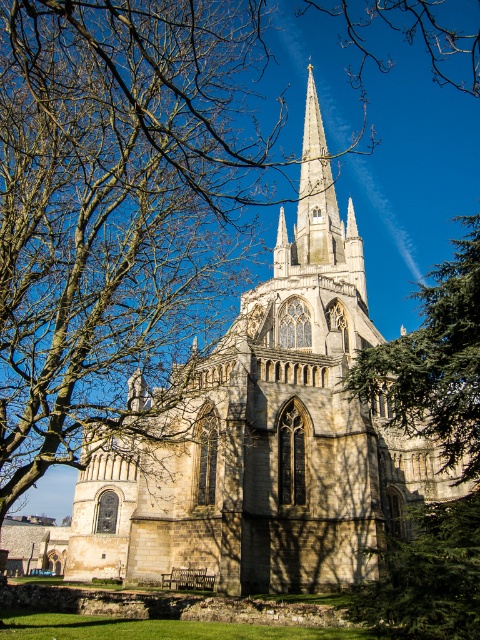
Is the position of stone church at center less distant than that of green leafy tree at right?

No, it is not.

Between stone church at center and green leafy tree at right, which one is positioned higher?

Positioned higher is stone church at center.

Image resolution: width=480 pixels, height=640 pixels. What do you see at coordinates (266, 435) in the screenshot? I see `stone church at center` at bounding box center [266, 435].

The height and width of the screenshot is (640, 480). I want to click on stone church at center, so click(x=266, y=435).

The height and width of the screenshot is (640, 480). Describe the element at coordinates (434, 362) in the screenshot. I see `green leafy tree at right` at that location.

Who is shorter, green leafy tree at right or white stone spire at upper center?

green leafy tree at right

What do you see at coordinates (434, 362) in the screenshot? I see `green leafy tree at right` at bounding box center [434, 362].

Locate an element on the screen. green leafy tree at right is located at coordinates (434, 362).

Can you confirm if green leafy tree at right is thinner than green textured pine tree at lower right?

No.

What do you see at coordinates (434, 362) in the screenshot?
I see `green leafy tree at right` at bounding box center [434, 362].

Is point (453, 314) positioned after point (394, 588)?

Yes, point (453, 314) is farther from viewer.

Where is `green leafy tree at right`? The image size is (480, 640). green leafy tree at right is located at coordinates (434, 362).